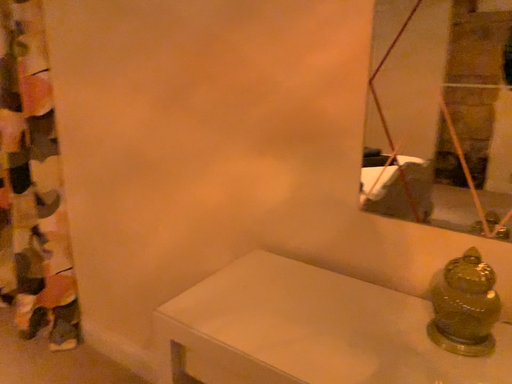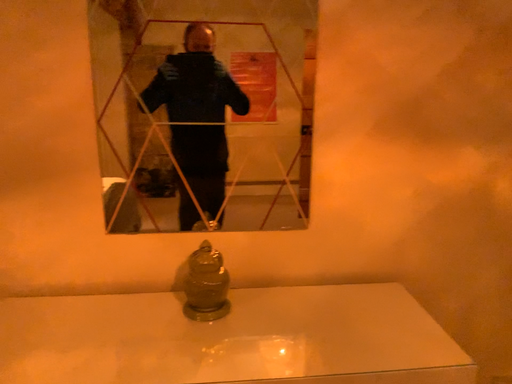
Question: Which way did the camera rotate in the video?

Choices:
 (A) rotated right
 (B) rotated left

Answer: (A)